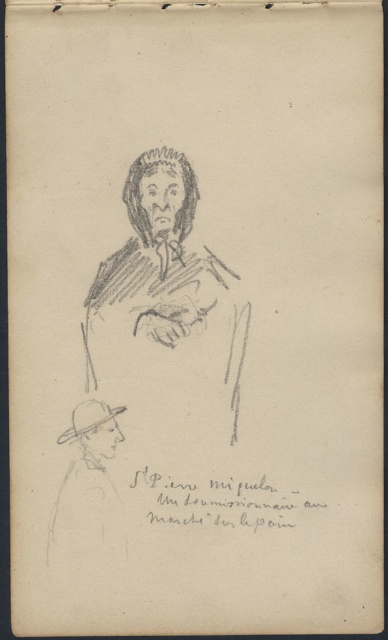
Can you confirm if charcoal sketch figure at center is positioned above charcoal sketch of man at bottom left?

Correct, charcoal sketch figure at center is located above charcoal sketch of man at bottom left.

The width and height of the screenshot is (388, 640). What do you see at coordinates (168, 278) in the screenshot?
I see `charcoal sketch figure at center` at bounding box center [168, 278].

Image resolution: width=388 pixels, height=640 pixels. I want to click on charcoal sketch figure at center, so click(x=168, y=278).